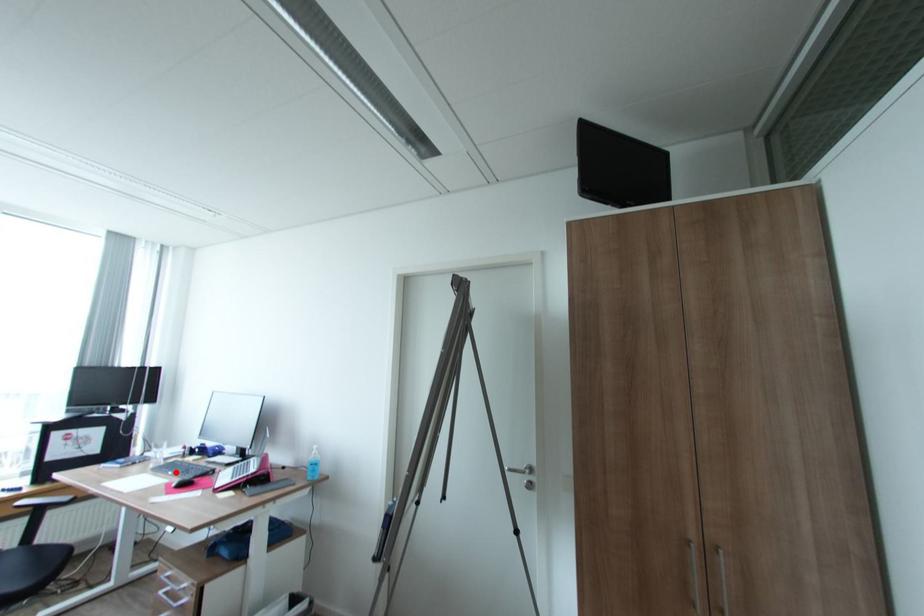
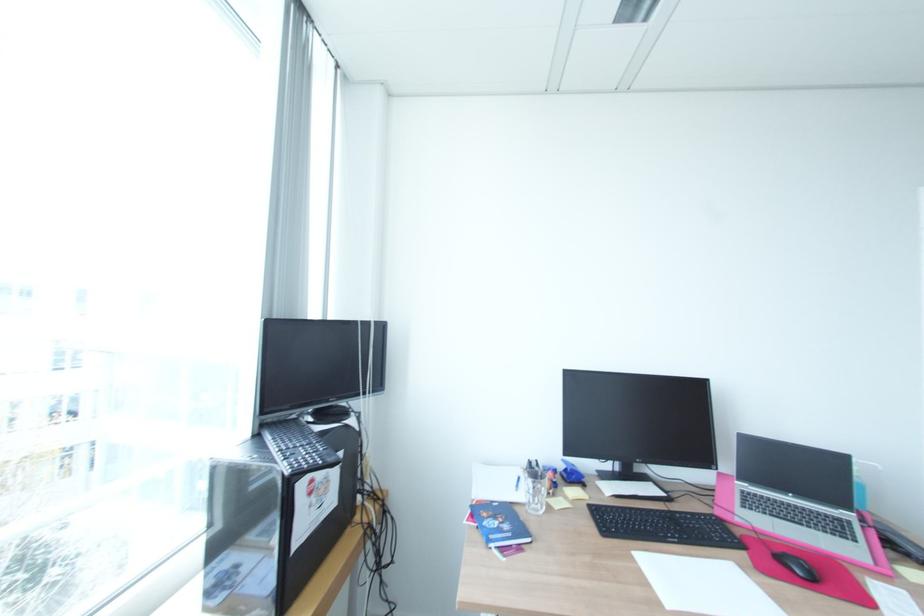
The point at the highlighted location is marked in the first image. Where is the corresponding point in the second image?

(681, 541)